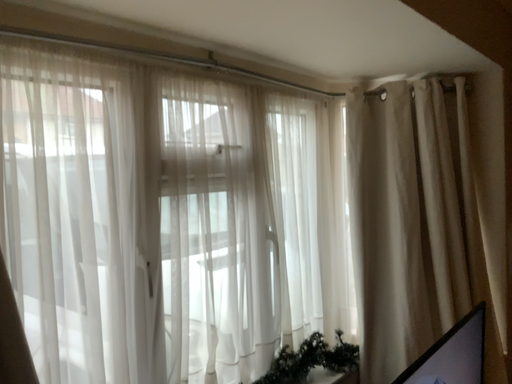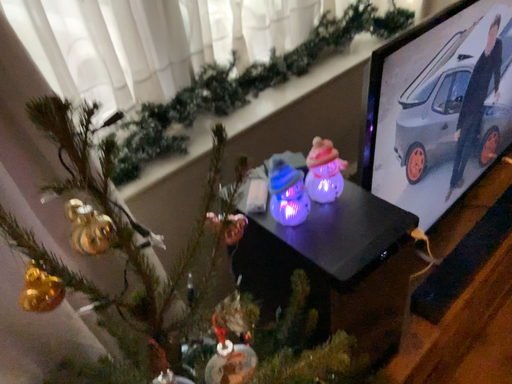
Question: Which way did the camera rotate in the video?

Choices:
 (A) rotated downward
 (B) rotated upward

Answer: (A)